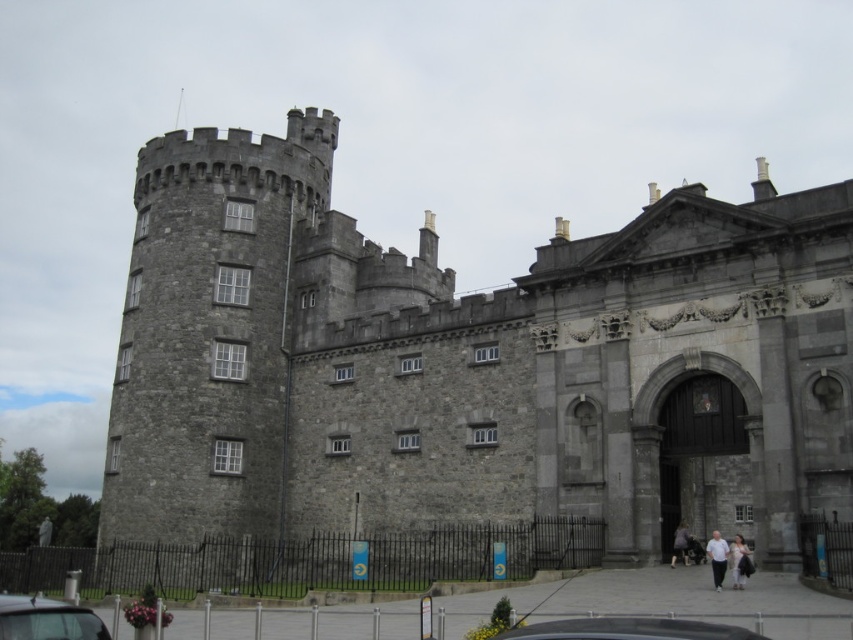
Which is more to the left, metallic gray car at center or dark gray fabric jacket at lower right?

Positioned to the left is metallic gray car at center.

Identify the location of metallic gray car at center. The height and width of the screenshot is (640, 853). (627, 628).

Consider the image. Can you confirm if white cotton shirt at lower right is wider than dark gray stone person at center?

Yes.

In order to click on white cotton shirt at lower right in this screenshot , I will do `click(717, 557)`.

Find the location of a particular element. This screenshot has height=640, width=853. white cotton shirt at lower right is located at coordinates (717, 557).

Is gray stone castle at left to the right of metallic gray car at center from the viewer's perspective?

Correct, you'll find gray stone castle at left to the right of metallic gray car at center.

Who is lower down, gray stone castle at left or metallic gray car at center?

metallic gray car at center is lower down.

Measure the distance between gray stone castle at left and camera.

The distance of gray stone castle at left from camera is 40.50 meters.

At what (x,y) coordinates should I click in order to perform the action: click on gray stone castle at left. Please return your answer as a coordinate pair (x, y). This screenshot has height=640, width=853. Looking at the image, I should click on (473, 364).